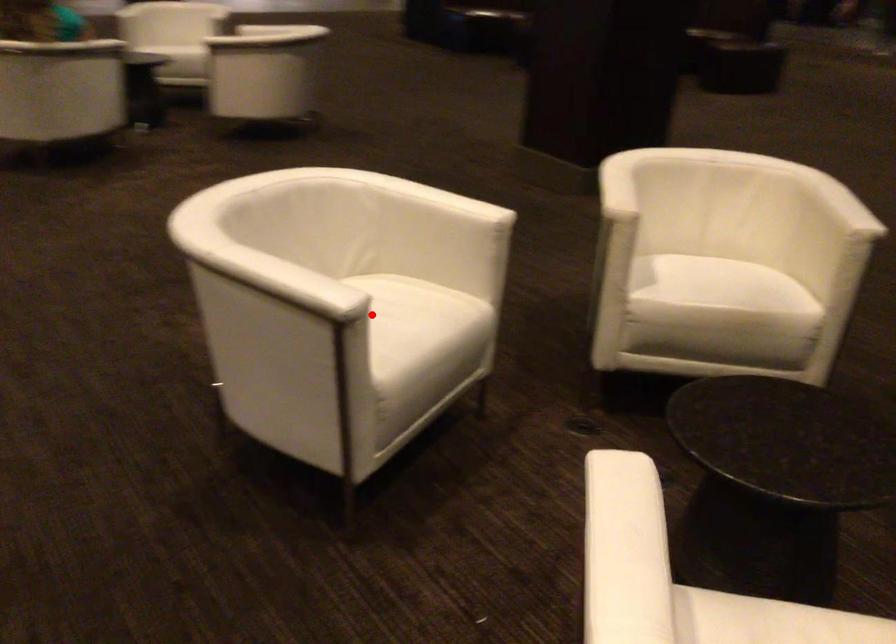
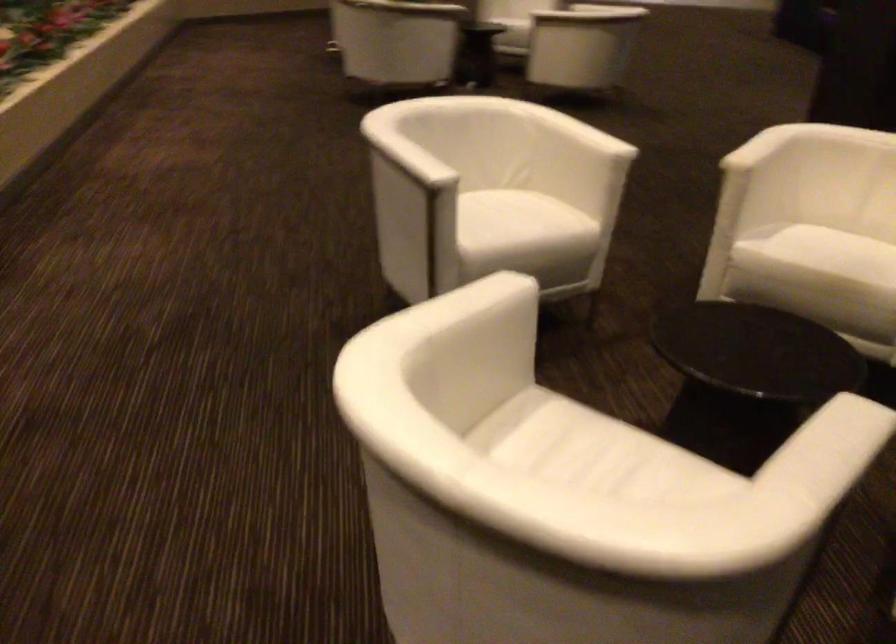
Question: I am providing you with two images of the same scene from different viewpoints. A red point is shown in image1. For the corresponding object point in image2, is it positioned nearer or farther from the camera?

Choices:
 (A) Nearer
 (B) Farther

Answer: (B)